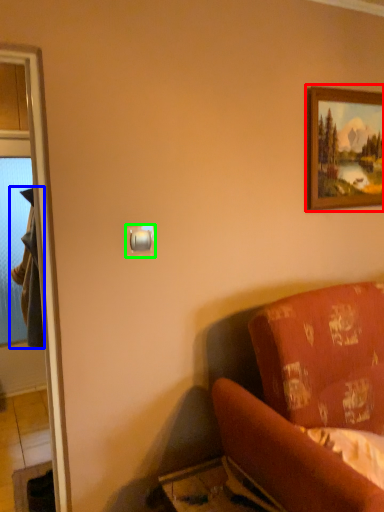
Question: Based on their relative distances, which object is nearer to picture frame (highlighted by a red box)? Choose from robe (highlighted by a blue box) and light switch (highlighted by a green box).

Choices:
 (A) robe
 (B) light switch

Answer: (B)